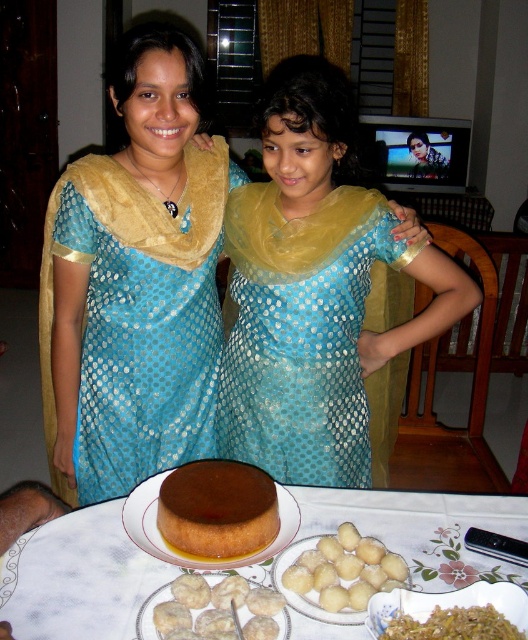
You are a guest at a dinner party and see the blue dotted fabric dress at center and the white glossy dumplings at center on the table. Which item is higher in height?

The blue dotted fabric dress at center is taller than the white glossy dumplings at center.

You are a photographer standing in the scene and want to take a closeup photo of the blue dotted fabric dress at center. The camera you are using has a minimum focusing distance of 1.5 meters. Can you take the photo without moving closer?

The blue dotted fabric dress at center and the viewer are 1.45 meters apart, which is less than the camera minimum focusing distance of 1.5 meters. Therefore, you cannot take the photo without moving closer.

Consider the image. You are a guest at a dinner party and see the blue dotted fabric dress at center and the white glossy dumplings at center on the table. Which item is positioned to the right side of the other?

The blue dotted fabric dress at center is to the right of the white glossy dumplings at center.